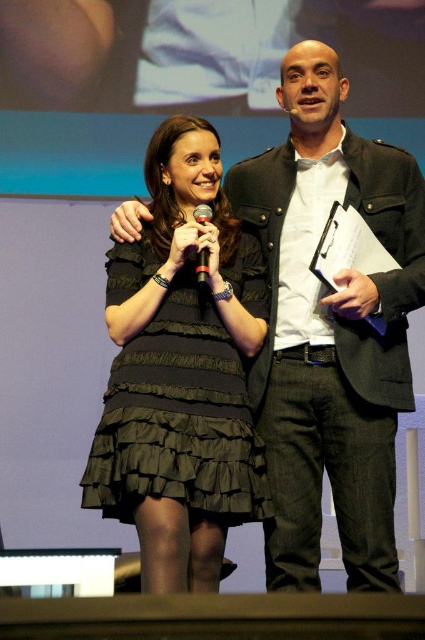
Question: Can you confirm if matte black jacket at center is smaller than black matte microphone at center?

Choices:
 (A) no
 (B) yes

Answer: (A)

Question: Is matte black jacket at center further to the viewer compared to black textured dress at center?

Choices:
 (A) yes
 (B) no

Answer: (A)

Question: Which of the following is the closest to the observer?

Choices:
 (A) black textured dress at center
 (B) matte black jacket at center
 (C) black matte microphone at center

Answer: (A)

Question: In this image, where is matte black jacket at center located relative to black matte microphone at center?

Choices:
 (A) above
 (B) below

Answer: (B)

Question: Which object is closer to the camera taking this photo?

Choices:
 (A) black matte microphone at center
 (B) matte black jacket at center
 (C) black textured dress at center

Answer: (C)

Question: Which of the following is the closest to the observer?

Choices:
 (A) (198, 262)
 (B) (295, 150)
 (C) (254, 460)

Answer: (A)